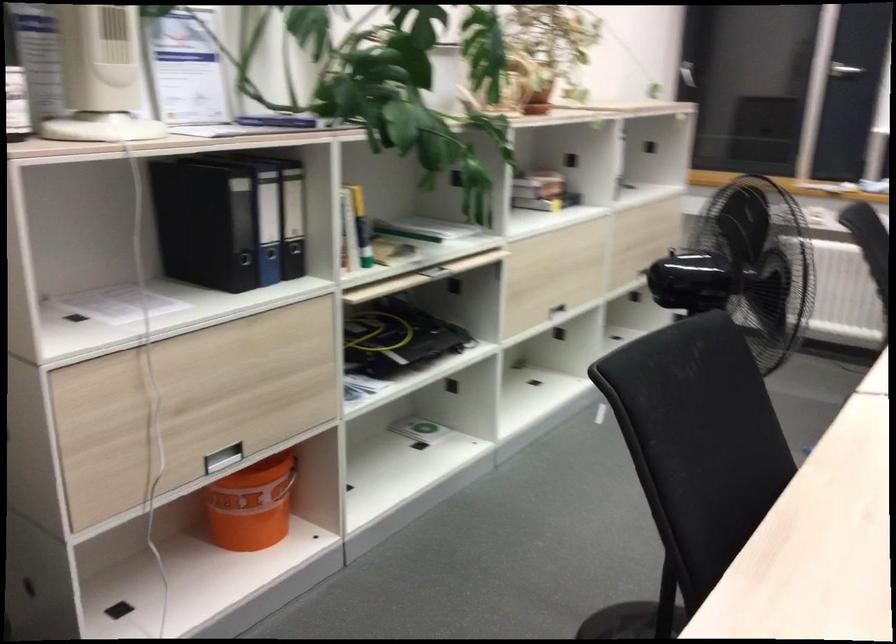
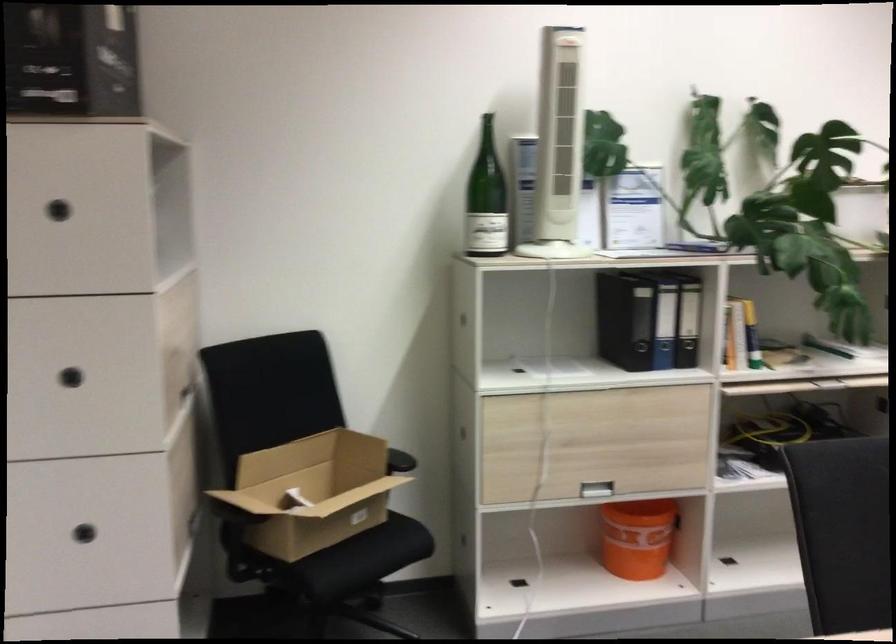
The point at (372, 500) is marked in the first image. Where is the corresponding point in the second image?

(738, 573)